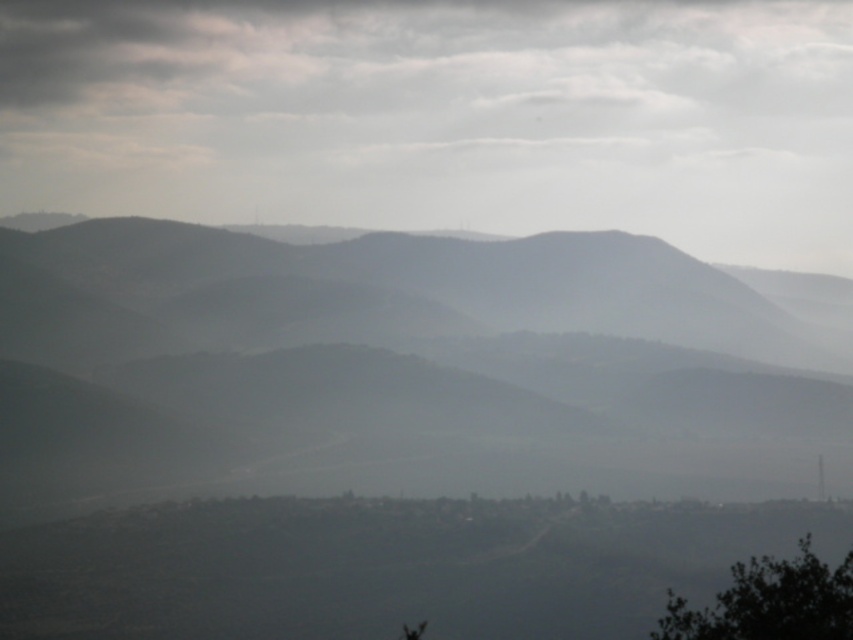
Question: Which point is closer to the camera?

Choices:
 (A) (100, 387)
 (B) (772, 627)

Answer: (B)

Question: Can you confirm if gray matte mountain range at center is positioned above green leafy tree at lower right?

Choices:
 (A) yes
 (B) no

Answer: (B)

Question: Among these objects, which one is farthest from the camera?

Choices:
 (A) gray matte mountain range at center
 (B) green leafy tree at lower right

Answer: (A)

Question: Is gray matte mountain range at center thinner than green leafy tree at lower right?

Choices:
 (A) no
 (B) yes

Answer: (A)

Question: Which of the following is the closest to the observer?

Choices:
 (A) green leafy tree at lower right
 (B) gray matte mountain range at center

Answer: (A)

Question: Is gray matte mountain range at center to the left of green leafy tree at lower right from the viewer's perspective?

Choices:
 (A) no
 (B) yes

Answer: (B)